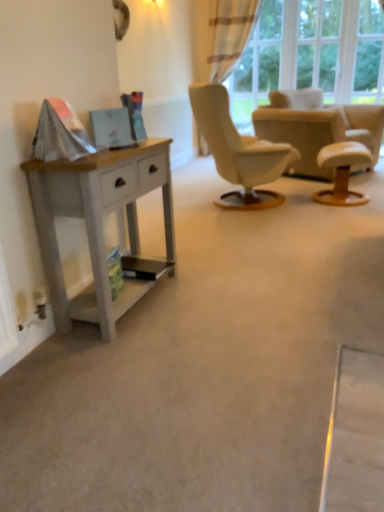
Question: From a real-world perspective, does beige fabric armchair at center stand above plaid fabric curtain at upper right?

Choices:
 (A) no
 (B) yes

Answer: (A)

Question: Considering the relative sizes of beige fabric armchair at center and plaid fabric curtain at upper right in the image provided, is beige fabric armchair at center wider than plaid fabric curtain at upper right?

Choices:
 (A) no
 (B) yes

Answer: (B)

Question: From the image's perspective, is beige fabric armchair at center below plaid fabric curtain at upper right?

Choices:
 (A) yes
 (B) no

Answer: (A)

Question: Is beige fabric armchair at center further to camera compared to plaid fabric curtain at upper right?

Choices:
 (A) no
 (B) yes

Answer: (A)

Question: Could you tell me if beige fabric armchair at center is facing plaid fabric curtain at upper right?

Choices:
 (A) yes
 (B) no

Answer: (B)

Question: Considering their positions, is white leather stool at right located in front of or behind transparent glass door at upper right?

Choices:
 (A) front
 (B) behind

Answer: (A)

Question: Based on their sizes in the image, would you say white leather stool at right is bigger or smaller than transparent glass door at upper right?

Choices:
 (A) small
 (B) big

Answer: (A)

Question: Is point (362, 200) closer or farther from the camera than point (278, 16)?

Choices:
 (A) farther
 (B) closer

Answer: (B)

Question: Is white leather stool at right taller or shorter than transparent glass door at upper right?

Choices:
 (A) short
 (B) tall

Answer: (A)

Question: Which is correct: plaid fabric curtain at upper right is inside white leather stool at right, or outside of it?

Choices:
 (A) inside
 (B) outside

Answer: (B)

Question: Looking at the image, does plaid fabric curtain at upper right seem bigger or smaller compared to white leather stool at right?

Choices:
 (A) small
 (B) big

Answer: (B)

Question: Is plaid fabric curtain at upper right in front of or behind white leather stool at right in the image?

Choices:
 (A) front
 (B) behind

Answer: (B)

Question: In terms of height, does plaid fabric curtain at upper right look taller or shorter compared to white leather stool at right?

Choices:
 (A) tall
 (B) short

Answer: (A)

Question: Do you think white wood desk at left is within plaid fabric curtain at upper right, or outside of it?

Choices:
 (A) outside
 (B) inside

Answer: (A)

Question: Is white wood desk at left taller or shorter than plaid fabric curtain at upper right?

Choices:
 (A) short
 (B) tall

Answer: (A)